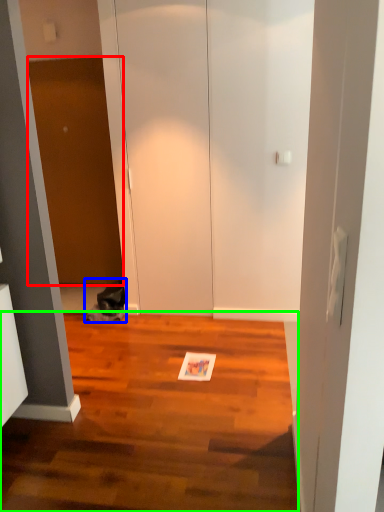
Question: Which object is positioned farthest from door (highlighted by a red box)? Select from cat (highlighted by a blue box) and hardwood (highlighted by a green box).

Choices:
 (A) cat
 (B) hardwood

Answer: (B)